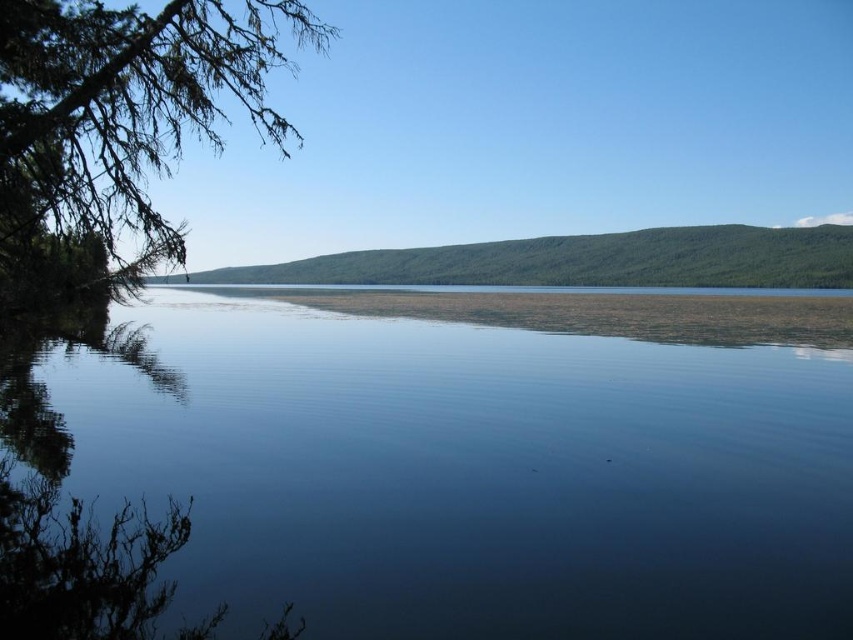
Is deep blue water at center below green leafy branch at upper left?

Yes.

Does deep blue water at center have a larger size compared to green leafy branch at upper left?

Incorrect, deep blue water at center is not larger than green leafy branch at upper left.

This screenshot has height=640, width=853. In order to click on deep blue water at center in this screenshot , I will do `click(415, 481)`.

Where is `deep blue water at center`? This screenshot has width=853, height=640. deep blue water at center is located at coordinates (415, 481).